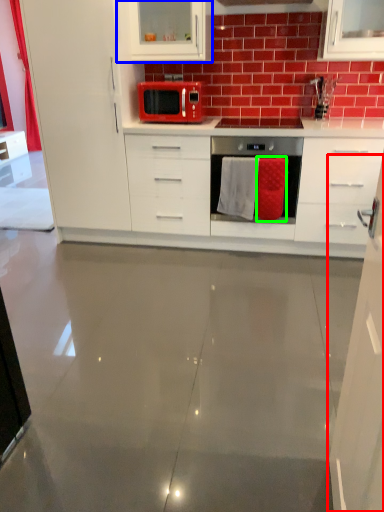
Question: Considering the real-world distances, which object is farthest from cabinetry (highlighted by a red box)? cabinetry (highlighted by a blue box) or cloth (highlighted by a green box)?

Choices:
 (A) cabinetry
 (B) cloth

Answer: (A)